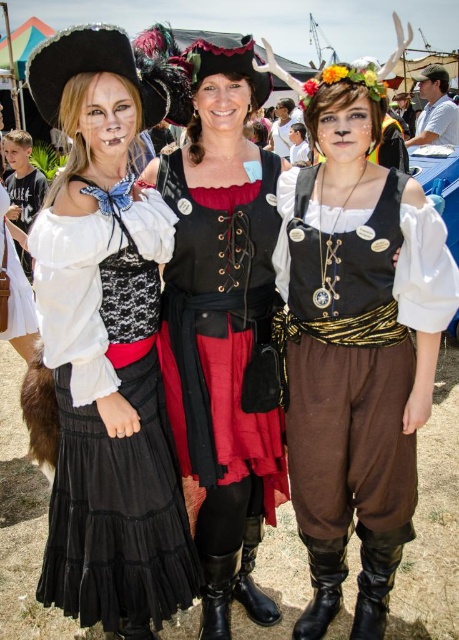
You are a photographer at the event and want to capture a photo where both the matte black vest at center and the white cotton shirt at upper right are clearly visible. However, the lighting is such that the front of the image is brighter than the back. Which object should you focus on to ensure both are properly exposed?

You should focus on the matte black vest at center since it is in front of the white cotton shirt at upper right. By focusing on the front object, you can balance the exposure for both, ensuring the front is not overexposed and the back is adequately lit.

You are organizing a costume party and need to ensure that all outfits fit through a narrow doorway. The doorway has a maximum width of 40 cm. You have two similar black vests from the image, one labeled as matte black vest at center and the other as black leather vest at center. Which vest should you choose to pass through the doorway without any adjustments?

The black leather vest at center should be chosen because its width is smaller than the matte black vest at center, making it more likely to fit through the 40 cm doorway.

You are organizing a costume parade and need to arrange the participants in order from widest to narrowest based on their costumes. Given the matte black dress at left and the white cotton shirt at upper right, which should come first?

The matte black dress at left should come first in the parade since its width surpasses the white cotton shirt at upper right, making it wider.